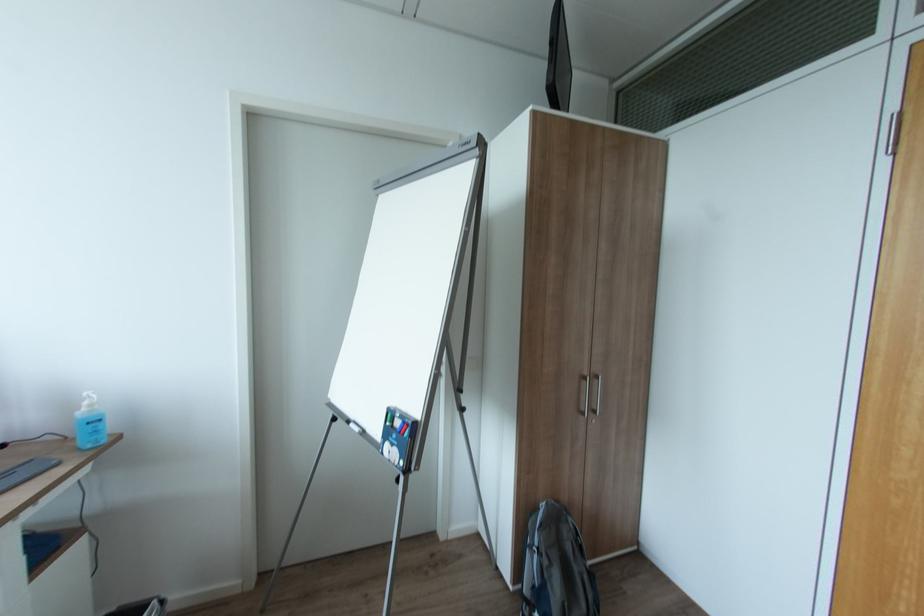
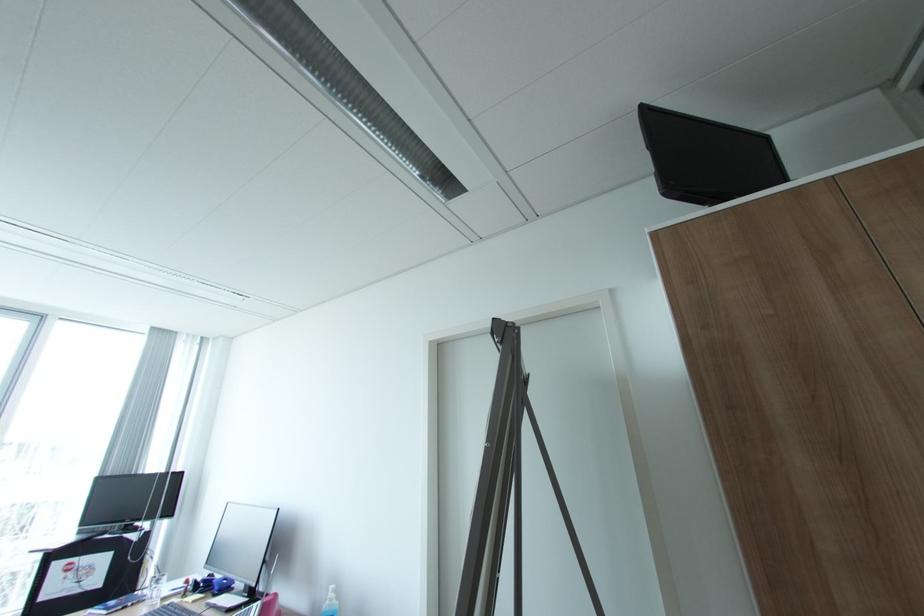
Where in the second image is the point corresponding to (x=94, y=407) from the first image?

(336, 599)